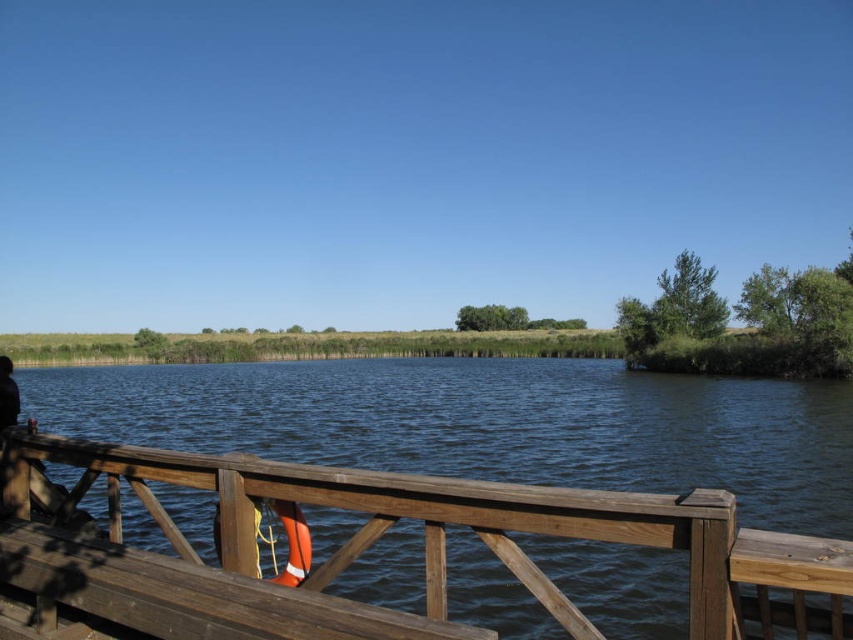
You are standing at the wooden railing on the lakeside and see two points marked on the water surface. Which point is closer to you, point (260, 497) or point (274, 506)?

Point (260, 497) is in front of point (274, 506), so it is closer to you.

You are a person who wants to place an orange fabric life jacket at lower center on top of the brown wooden rail at lower center. Based on the scene description, will the life jacket stay on top of the rail without falling off?

The brown wooden rail at lower center is taller than orange fabric life jacket at lower center, so the life jacket can be placed on top of the rail without falling off since the rail is higher than the jacket.